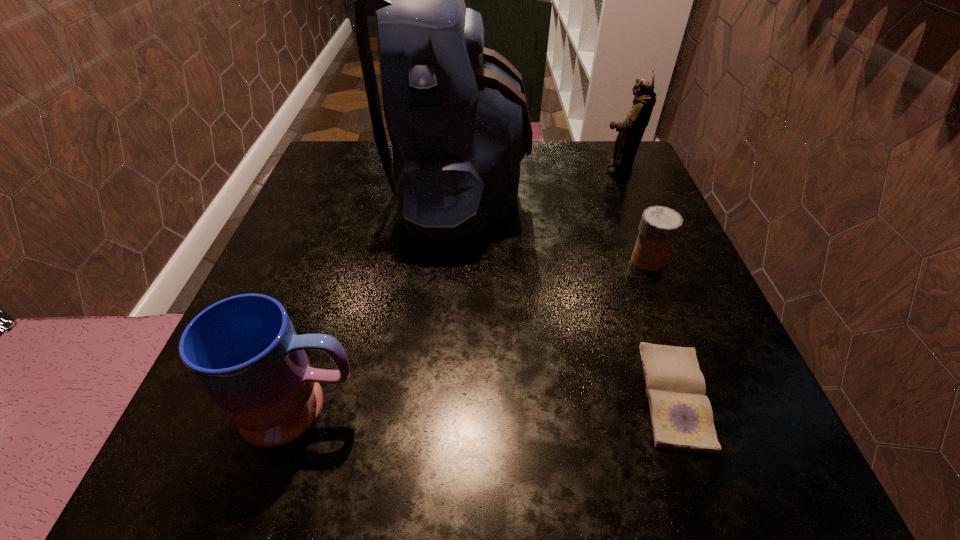
Identify the location of the tallest object. (457, 115).

The width and height of the screenshot is (960, 540). In order to click on figurine in this screenshot , I will do `click(631, 130)`.

The image size is (960, 540). Find the location of `mug`. mug is located at coordinates (244, 351).

Where is `the second shortest object`? the second shortest object is located at coordinates (659, 227).

The image size is (960, 540). I want to click on the shortest object, so click(681, 415).

This screenshot has width=960, height=540. Identify the location of vacant space positioned 0.250m at the front pocket of the backpack. coord(639,191).

Locate an element on the screen. This screenshot has width=960, height=540. vacant area situated on the front-facing side of the fourth shortest object is located at coordinates (533, 171).

The image size is (960, 540). Identify the location of free space located on the front-facing side of the fourth shortest object. (476, 171).

Where is `blank space located on the front-facing side of the fourth shortest object`? The height and width of the screenshot is (540, 960). blank space located on the front-facing side of the fourth shortest object is located at coordinates (554, 171).

Find the location of a particular element. The width and height of the screenshot is (960, 540). free spot located on the side of the third tallest object with the handle is located at coordinates (541, 408).